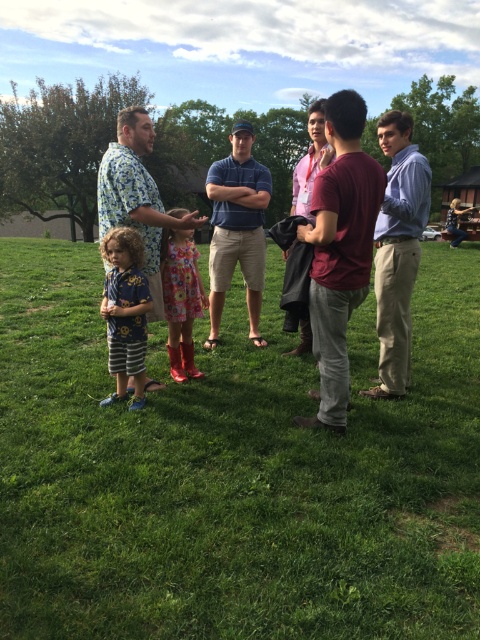
Question: Can you confirm if green grass at center is positioned above blue cotton polo shirt at center?

Choices:
 (A) no
 (B) yes

Answer: (A)

Question: Estimate the real-world distances between objects in this image. Which object is closer to the floral fabric shirt at upper left?

Choices:
 (A) light blue shirt at right
 (B) floral dress at center
 (C) maroon cotton shirt at center

Answer: (A)

Question: Which of these objects is positioned farthest from the blue printed shirt at lower left?

Choices:
 (A) maroon cotton shirt at center
 (B) floral fabric shirt at upper left

Answer: (A)

Question: Does maroon cotton t-shirt at center appear under blue printed shirt at lower left?

Choices:
 (A) yes
 (B) no

Answer: (B)

Question: Which of the following is the farthest from the observer?

Choices:
 (A) (343, 195)
 (B) (309, 204)

Answer: (B)

Question: Is floral fabric shirt at upper left positioned in front of maroon cotton shirt at center?

Choices:
 (A) yes
 (B) no

Answer: (A)